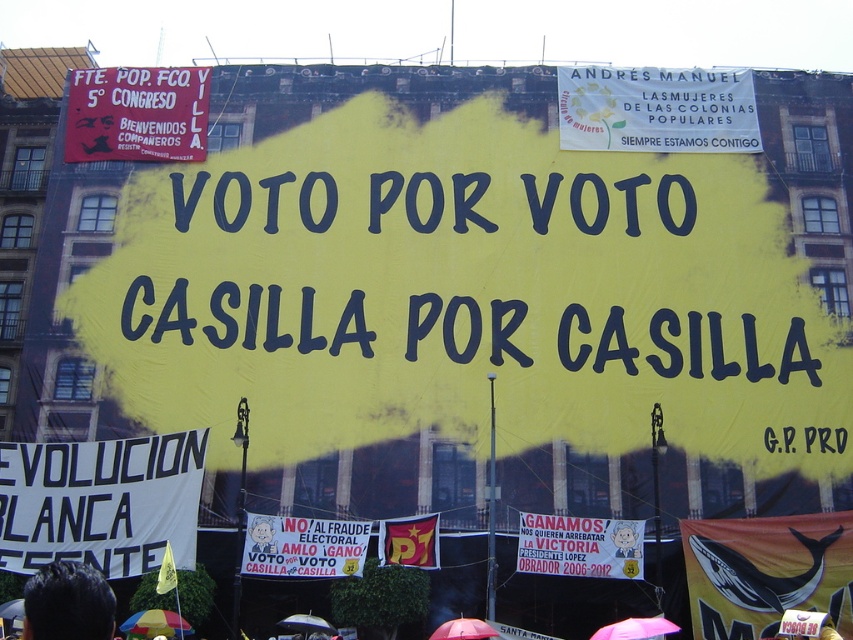
You are a photographer standing at the back of the rally. You want to capture both the orange fabric whale at lower right and the white paper banner at lower center in a single shot. The camera you have can only focus on objects within a 20 meter range. Can you take the photo without moving?

The distance between the orange fabric whale at lower right and the white paper banner at lower center is 19.17 meters, which is within the camera focus range of 20 meters. Therefore, you can capture both objects in a single shot without moving.

You are standing at the camera position observing the political rally scene. There is a point at coordinates point (738, 129). Can you reach that point by walking forward 60 meters?

The distance of point (738, 129) from camera is 68.48 meters, so walking forward 60 meters would not reach it since 60 meters is less than the required distance.